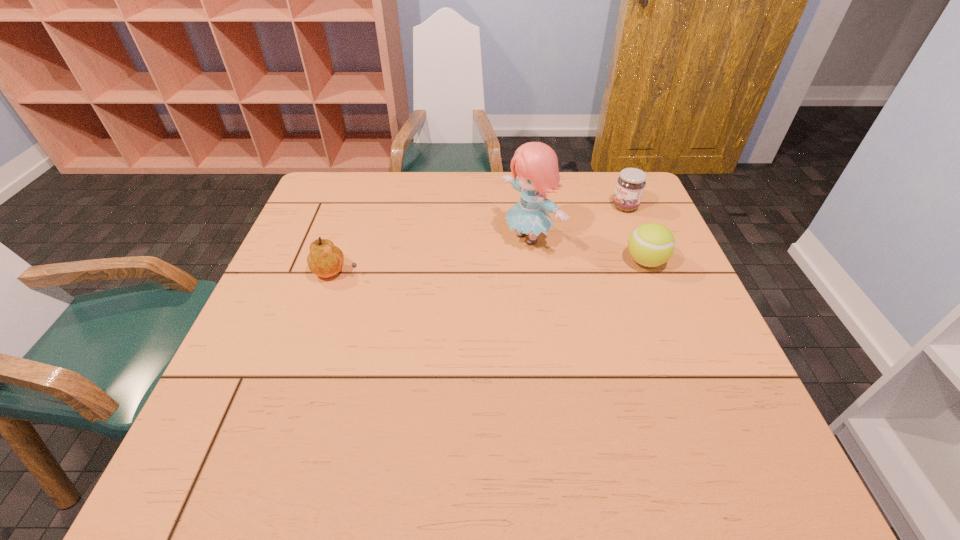
Where is `vacant region that satisfies the following two spatial constraints: 1. on the back side of the tennis ball; 2. on the left side of the farthest object`? The width and height of the screenshot is (960, 540). vacant region that satisfies the following two spatial constraints: 1. on the back side of the tennis ball; 2. on the left side of the farthest object is located at coordinates (624, 207).